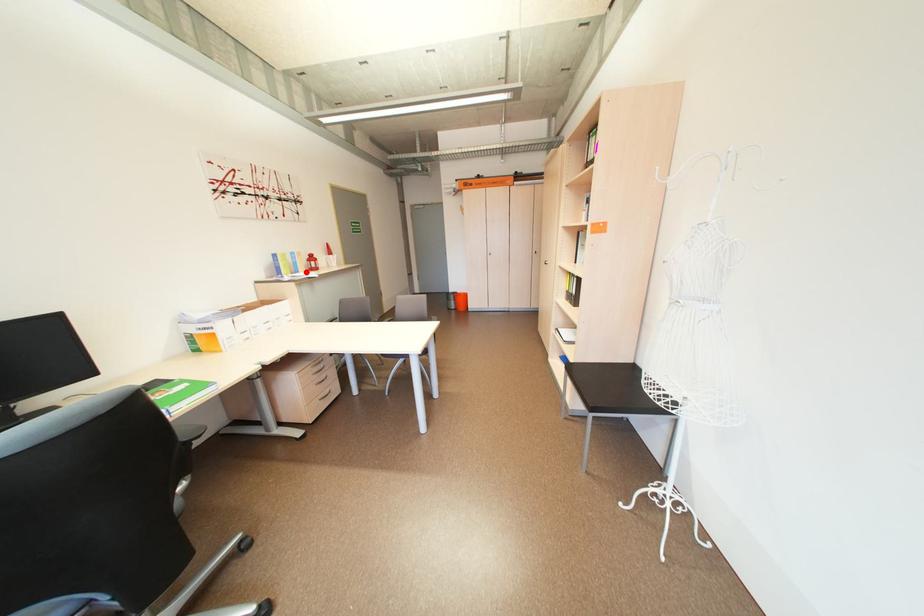
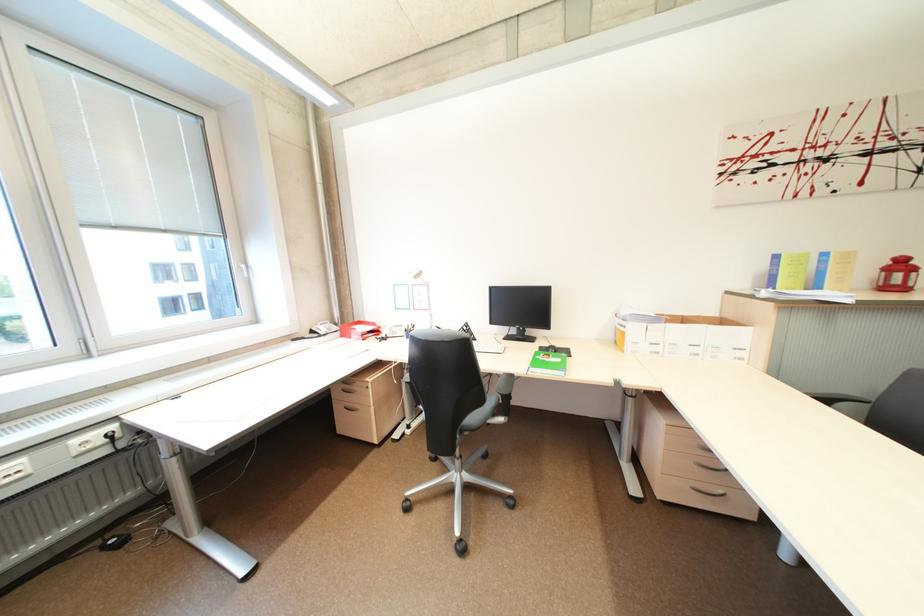
Find the pixel in the second image that matches the highlighted location in the first image.

(825, 286)